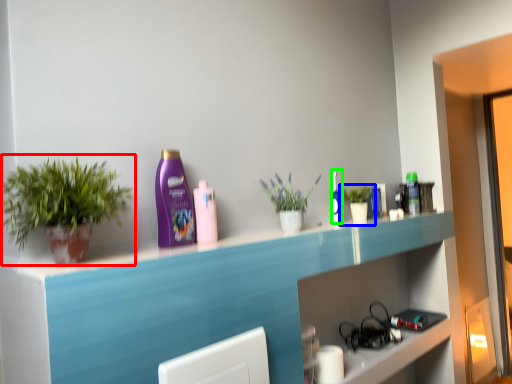
Question: Which is farther away from houseplant (highlighted by a red box)? houseplant (highlighted by a blue box) or mouthwash (highlighted by a green box)?

Choices:
 (A) houseplant
 (B) mouthwash

Answer: (A)